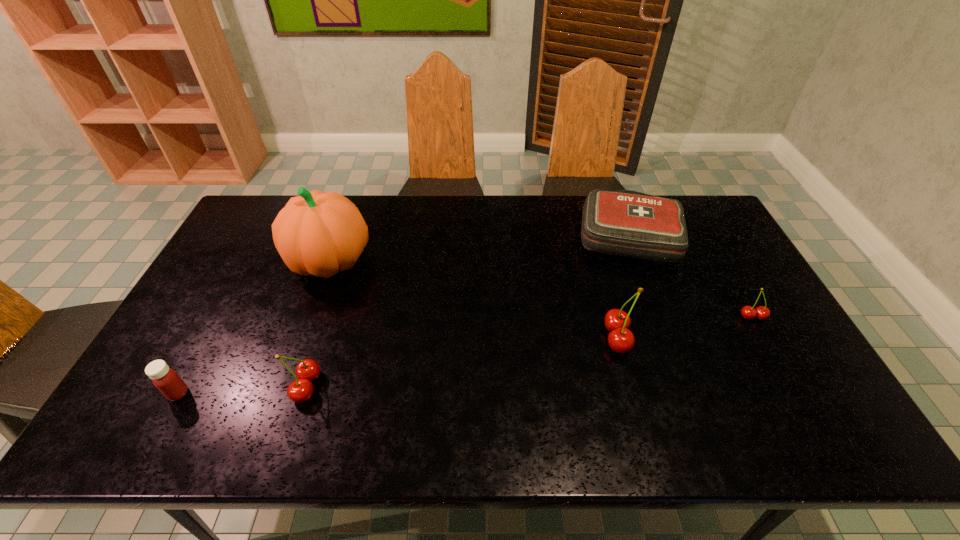
Where is `empty space that is in between the pumpkin and the leftmost object`? This screenshot has width=960, height=540. empty space that is in between the pumpkin and the leftmost object is located at coordinates (254, 327).

Locate an element on the screen. The width and height of the screenshot is (960, 540). vacant area that lies between the tallest object and the shortest cherry is located at coordinates (541, 289).

Where is `unoccupied position between the second cherry from right to left and the third tallest object`? unoccupied position between the second cherry from right to left and the third tallest object is located at coordinates (462, 362).

What are the coordinates of `vacant space that's between the first-aid kit and the fourth shortest object` in the screenshot? It's located at (468, 310).

This screenshot has height=540, width=960. Find the location of `vacant space in between the first-aid kit and the tallest object`. vacant space in between the first-aid kit and the tallest object is located at coordinates (480, 247).

Identify the location of free point between the second cherry from right to left and the first-aid kit. Image resolution: width=960 pixels, height=540 pixels. (624, 286).

At what (x,y) coordinates should I click in order to perform the action: click on vacant region between the second cherry from left to right and the leftmost object. Please return your answer as a coordinate pair (x, y). Looking at the image, I should click on (397, 366).

Locate an element on the screen. empty space that is in between the rightmost cherry and the third tallest object is located at coordinates (530, 352).

I want to click on free space between the nearest cherry and the rightmost cherry, so click(x=530, y=352).

Locate an element on the screen. The height and width of the screenshot is (540, 960). object that is the third closest one to the leftmost object is located at coordinates (620, 339).